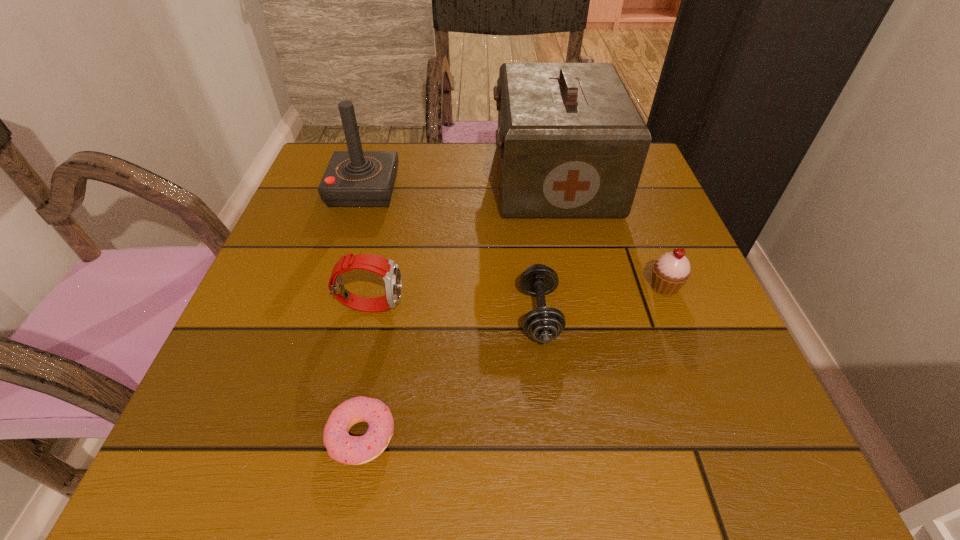
Image resolution: width=960 pixels, height=540 pixels. In order to click on the first-aid kit in this screenshot , I will do `click(572, 144)`.

At what (x,y) coordinates should I click in order to perform the action: click on joystick. Please return your answer as a coordinate pair (x, y). The width and height of the screenshot is (960, 540). Looking at the image, I should click on (355, 178).

I want to click on the fourth shortest object, so click(x=388, y=269).

Where is `the fourth tallest object`? the fourth tallest object is located at coordinates (670, 272).

This screenshot has height=540, width=960. In order to click on dumbbell in this screenshot , I will do [544, 324].

You are a GUI agent. You are given a task and a screenshot of the screen. Output one action in this format:
    pyautogui.click(x=<x>, y=<y>)
    Task: Click on the nearest object
    Image resolution: width=960 pixels, height=540 pixels.
    Given the screenshot: What is the action you would take?
    pyautogui.click(x=354, y=450)

Where is `doughnut`? This screenshot has width=960, height=540. doughnut is located at coordinates (354, 450).

Locate an element on the screen. The image size is (960, 540). vacant area located 0.370m on the front of the first-aid kit is located at coordinates (595, 371).

This screenshot has width=960, height=540. I want to click on free space located on the rectangular base of the joystick, so click(x=569, y=190).

Image resolution: width=960 pixels, height=540 pixels. What are the coordinates of `free location located on the face of the third tallest object` in the screenshot? It's located at (465, 305).